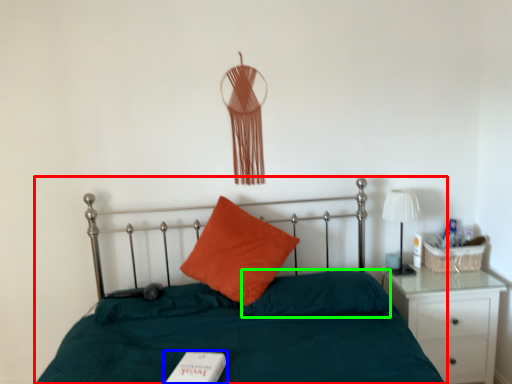
Question: Estimate the real-world distances between objects in this image. Which object is farther from bed (highlighted by a red box), book (highlighted by a blue box) or pillow (highlighted by a green box)?

Choices:
 (A) book
 (B) pillow

Answer: (A)